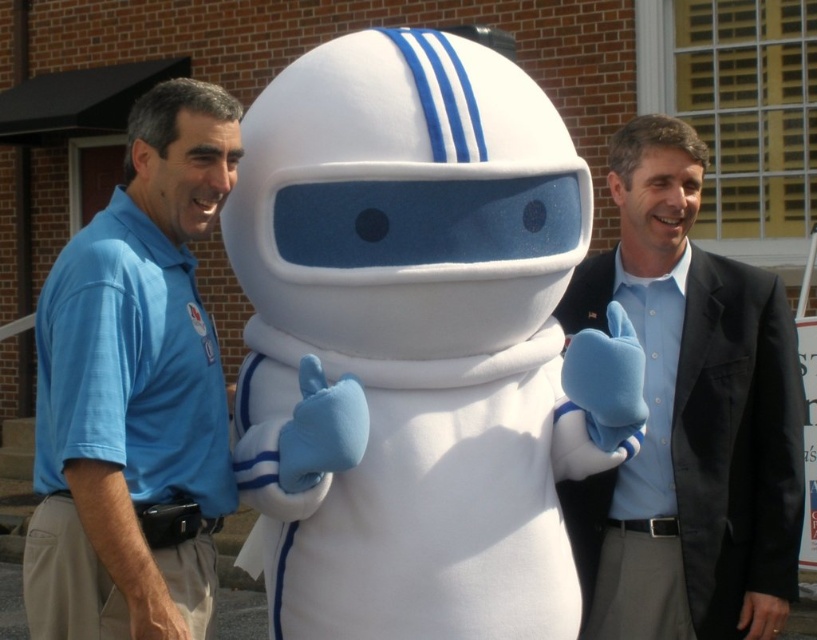
Question: Is blue cotton shirt at left positioned in front of light blue shirt at right?

Choices:
 (A) yes
 (B) no

Answer: (A)

Question: Can you confirm if blue cotton shirt at left is positioned to the left of light blue shirt at right?

Choices:
 (A) no
 (B) yes

Answer: (B)

Question: Is blue cotton shirt at left positioned behind light blue shirt at right?

Choices:
 (A) yes
 (B) no

Answer: (B)

Question: Which point is farther from the camera taking this photo?

Choices:
 (A) (775, 435)
 (B) (146, 284)

Answer: (A)

Question: Among these objects, which one is nearest to the camera?

Choices:
 (A) blue cotton shirt at left
 (B) light blue shirt at right

Answer: (A)